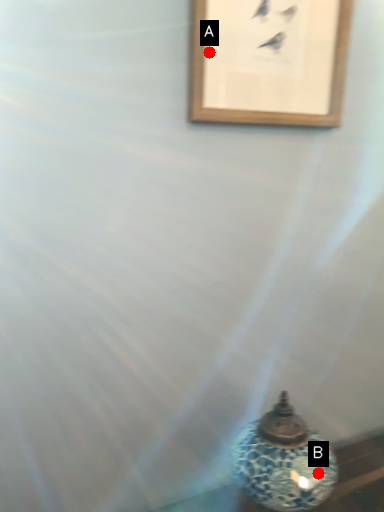
Question: Two points are circled on the image, labeled by A and B beside each circle. Among these points, which one is farthest from the camera?

Choices:
 (A) A is further
 (B) B is further

Answer: (A)